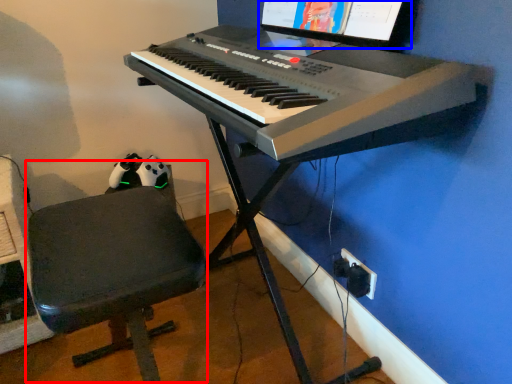
Question: Which object is further to the camera taking this photo, computer chair (highlighted by a red box) or computer monitor (highlighted by a blue box)?

Choices:
 (A) computer chair
 (B) computer monitor

Answer: (B)